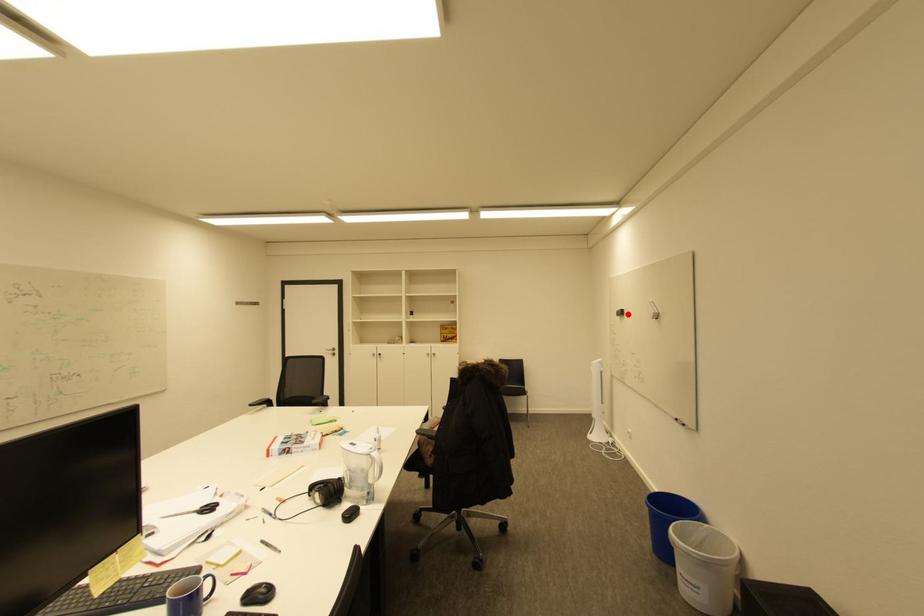
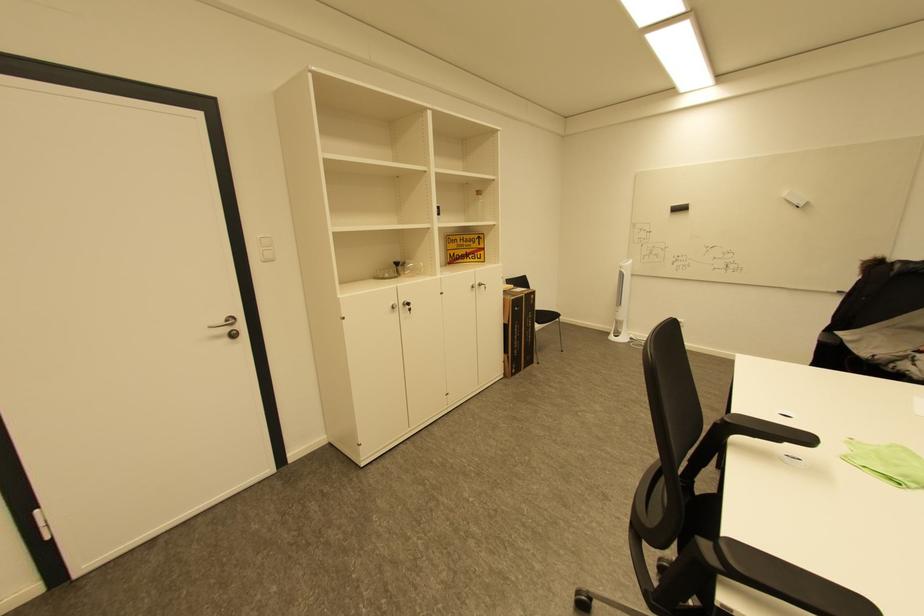
The point at the highlighted location is marked in the first image. Where is the corresponding point in the second image?

(686, 209)